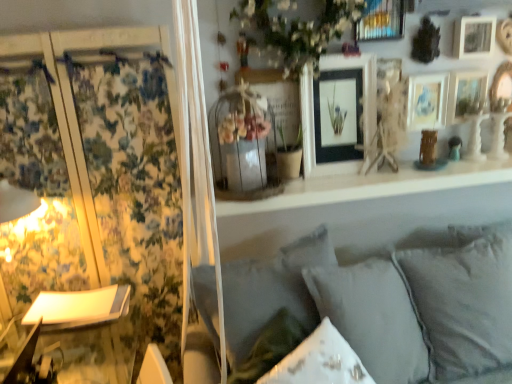
Question: Can you confirm if white soft cushions at lower right is bigger than white matte flower at upper center?

Choices:
 (A) yes
 (B) no

Answer: (A)

Question: Is white soft cushions at lower right not within white matte flower at upper center?

Choices:
 (A) no
 (B) yes

Answer: (B)

Question: Does white soft cushions at lower right come in front of white matte flower at upper center?

Choices:
 (A) no
 (B) yes

Answer: (B)

Question: Is white soft cushions at lower right thinner than white matte flower at upper center?

Choices:
 (A) no
 (B) yes

Answer: (A)

Question: Is white soft cushions at lower right not close to white matte flower at upper center?

Choices:
 (A) yes
 (B) no

Answer: (B)

Question: Considering the positions of white matte shelf at upper center and white soft cushions at lower right in the image, is white matte shelf at upper center taller or shorter than white soft cushions at lower right?

Choices:
 (A) tall
 (B) short

Answer: (B)

Question: Would you say white matte shelf at upper center is to the left or to the right of white soft cushions at lower right in the picture?

Choices:
 (A) right
 (B) left

Answer: (A)

Question: From a real-world perspective, is white matte shelf at upper center positioned above or below white soft cushions at lower right?

Choices:
 (A) below
 (B) above

Answer: (B)

Question: Does point (253, 203) appear closer or farther from the camera than point (274, 302)?

Choices:
 (A) farther
 (B) closer

Answer: (A)

Question: In the image, is matte black picture frame at upper center, arranged as the sixth picture frame when viewed from the right, positioned in front of or behind white matte flower at upper center?

Choices:
 (A) behind
 (B) front

Answer: (A)

Question: In the image, is matte black picture frame at upper center, arranged as the sixth picture frame when viewed from the right, on the left side or the right side of white matte flower at upper center?

Choices:
 (A) left
 (B) right

Answer: (B)

Question: Does point (307, 135) appear closer or farther from the camera than point (281, 21)?

Choices:
 (A) farther
 (B) closer

Answer: (A)

Question: Do you think matte black picture frame at upper center, which is the first picture frame in left-to-right order, is within white matte flower at upper center, or outside of it?

Choices:
 (A) outside
 (B) inside

Answer: (A)

Question: Is white matte flower at upper center inside the boundaries of gray fabric pillow at lower center, marked as the 2th pillow in a right-to-left arrangement, or outside?

Choices:
 (A) inside
 (B) outside

Answer: (B)

Question: In the image, is white matte flower at upper center positioned in front of or behind gray fabric pillow at lower center, marked as the 2th pillow in a right-to-left arrangement?

Choices:
 (A) behind
 (B) front

Answer: (A)